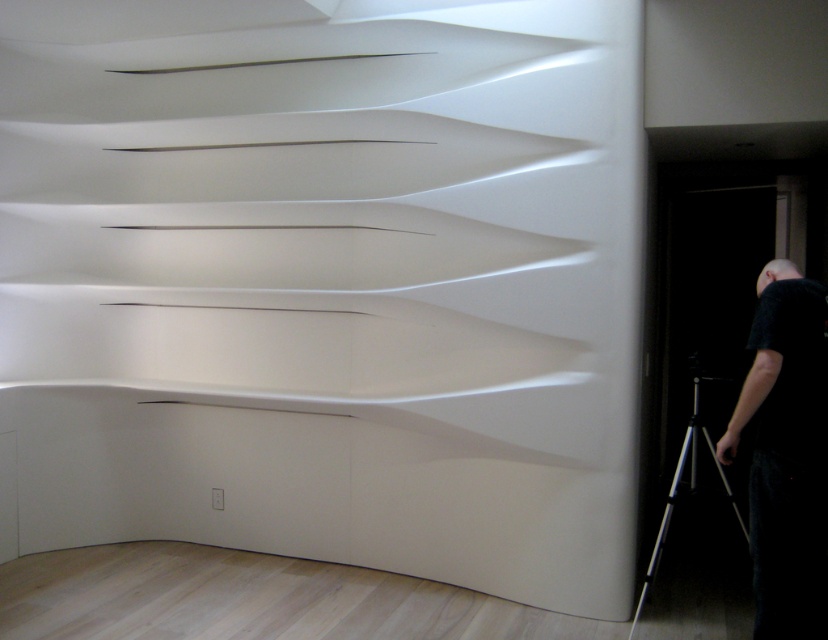
Question: Is black matte person at lower right closer to the viewer compared to silver metallic tripod at lower right?

Choices:
 (A) no
 (B) yes

Answer: (B)

Question: In this image, where is black matte person at lower right located relative to silver metallic tripod at lower right?

Choices:
 (A) below
 (B) above

Answer: (B)

Question: Can you confirm if black matte person at lower right is positioned above silver metallic tripod at lower right?

Choices:
 (A) no
 (B) yes

Answer: (B)

Question: Which point is farther to the camera?

Choices:
 (A) black matte person at lower right
 (B) silver metallic tripod at lower right

Answer: (B)

Question: Among these objects, which one is farthest from the camera?

Choices:
 (A) black matte person at lower right
 (B) silver metallic tripod at lower right

Answer: (B)

Question: Which object appears farthest from the camera in this image?

Choices:
 (A) black matte person at lower right
 (B) silver metallic tripod at lower right

Answer: (B)